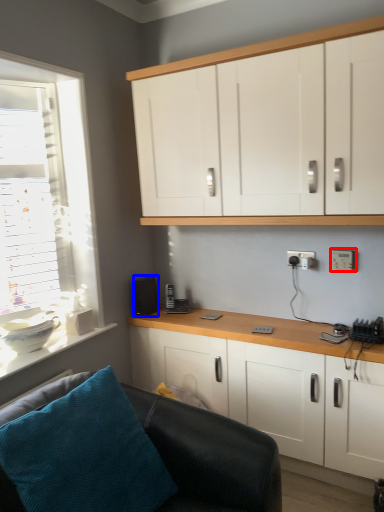
Question: Which object is further to the camera taking this photo, electric outlet (highlighted by a red box) or speaker (highlighted by a blue box)?

Choices:
 (A) electric outlet
 (B) speaker

Answer: (B)